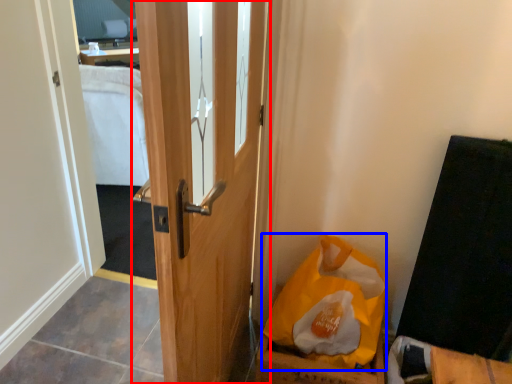
Question: Which object appears farthest to the camera in this image, door (highlighted by a red box) or paper bag (highlighted by a blue box)?

Choices:
 (A) door
 (B) paper bag

Answer: (B)